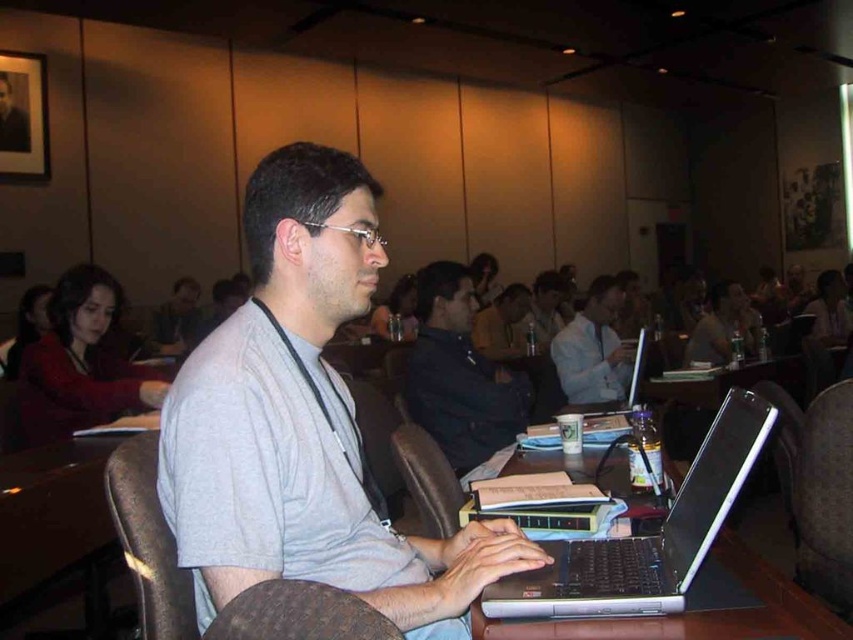
Question: Based on their relative distances, which object is farther from the dark blue shirt at center?

Choices:
 (A) brown leather chair at lower right
 (B) gray matte shirt at center
 (C) matte black laptop at center

Answer: (C)

Question: Can you confirm if dark blue shirt at center is thinner than brown leather chair at lower right?

Choices:
 (A) yes
 (B) no

Answer: (B)

Question: Is light blue shirt at center closer to the viewer compared to brown leather chair at center?

Choices:
 (A) no
 (B) yes

Answer: (A)

Question: From the image, what is the correct spatial relationship of brown leather chair at lower left in relation to silver metallic laptop at center?

Choices:
 (A) right
 (B) left

Answer: (B)

Question: Which of these objects is positioned farthest from the brown leather chair at lower right?

Choices:
 (A) light blue shirt at center
 (B) silver metallic laptop at center
 (C) gray matte shirt at center

Answer: (A)

Question: Which object appears closest to the camera in this image?

Choices:
 (A) brown leather chair at lower right
 (B) silver/black plastic laptop at center

Answer: (B)